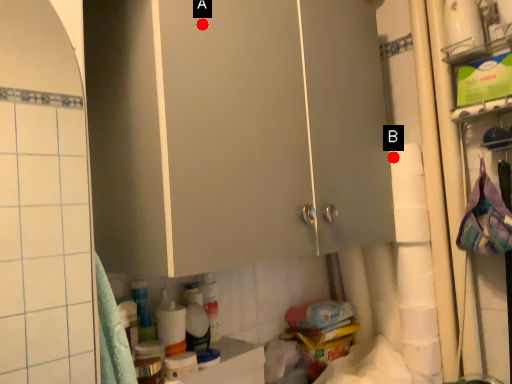
Question: Two points are circled on the image, labeled by A and B beside each circle. Which point is farther from the camera taking this photo?

Choices:
 (A) A is further
 (B) B is further

Answer: (B)